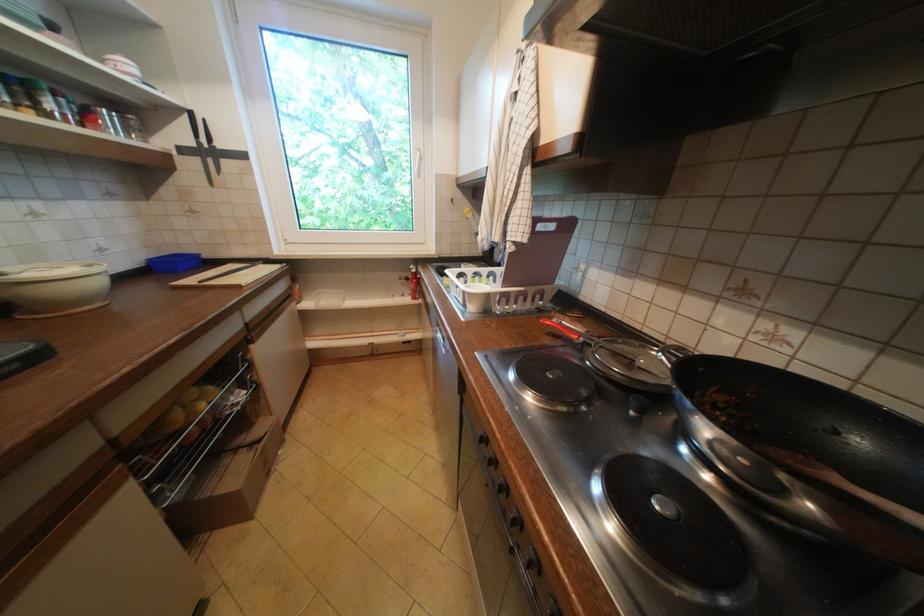
Where is `wire drawer handle`? The width and height of the screenshot is (924, 616). wire drawer handle is located at coordinates (258, 463).